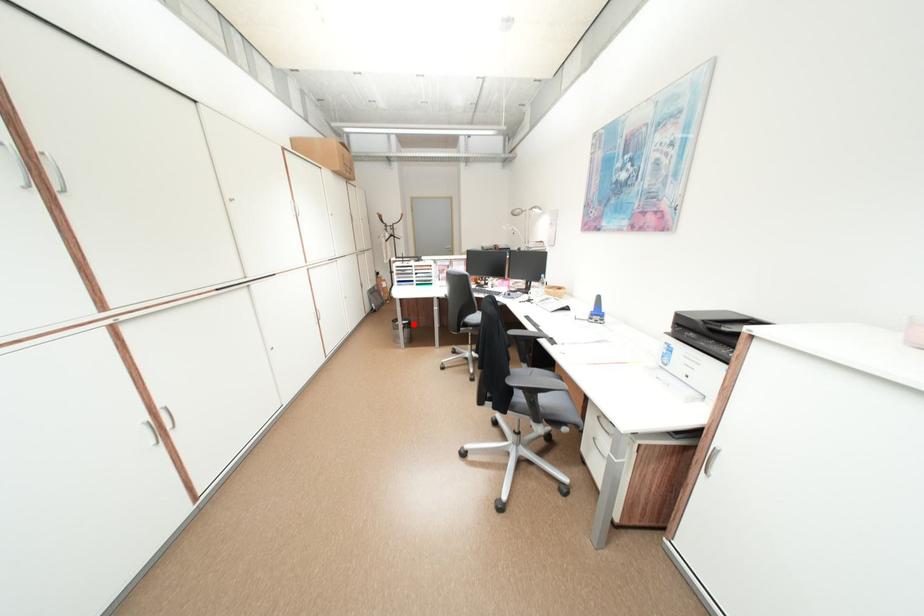
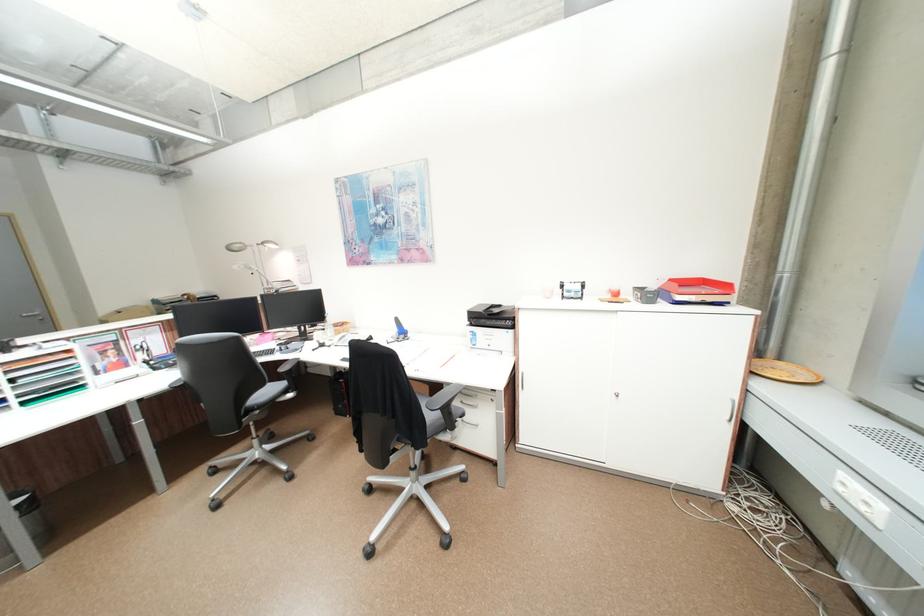
The point at the highlighted location is marked in the first image. Where is the corresponding point in the second image?

(27, 509)